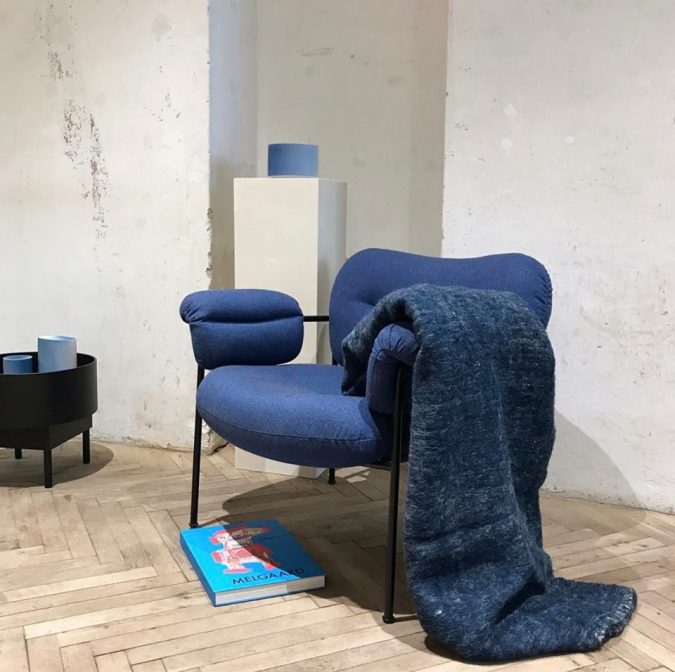
You are a GUI agent. You are given a task and a screenshot of the screen. Output one action in this format:
    pyautogui.click(x=<x>, y=<y>)
    Task: Click on the backrest
    The width and height of the screenshot is (675, 672).
    Given the screenshot: What is the action you would take?
    pyautogui.click(x=439, y=273)